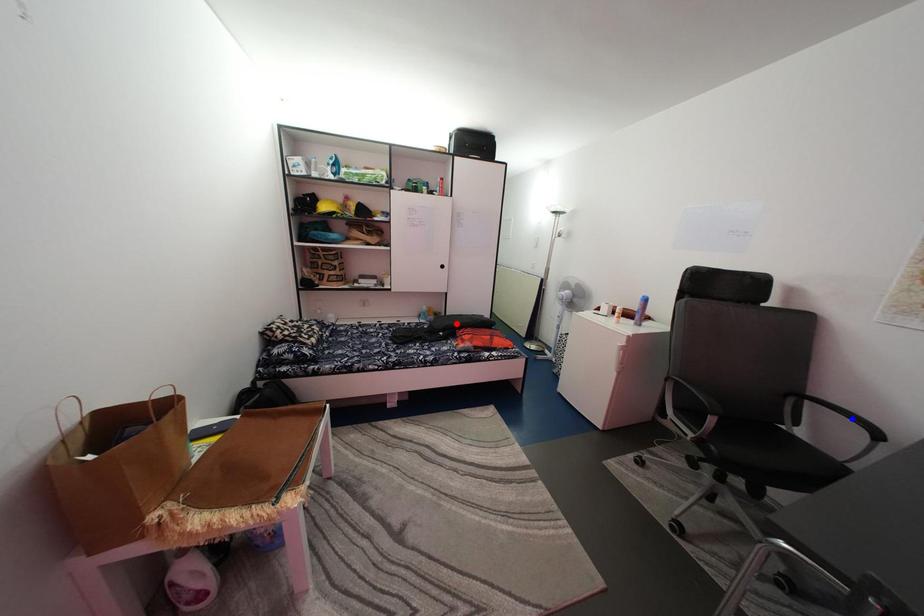
Question: Two points are marked on the image. Which point is closer to the camera?

Choices:
 (A) Blue point is closer.
 (B) Red point is closer.

Answer: (A)